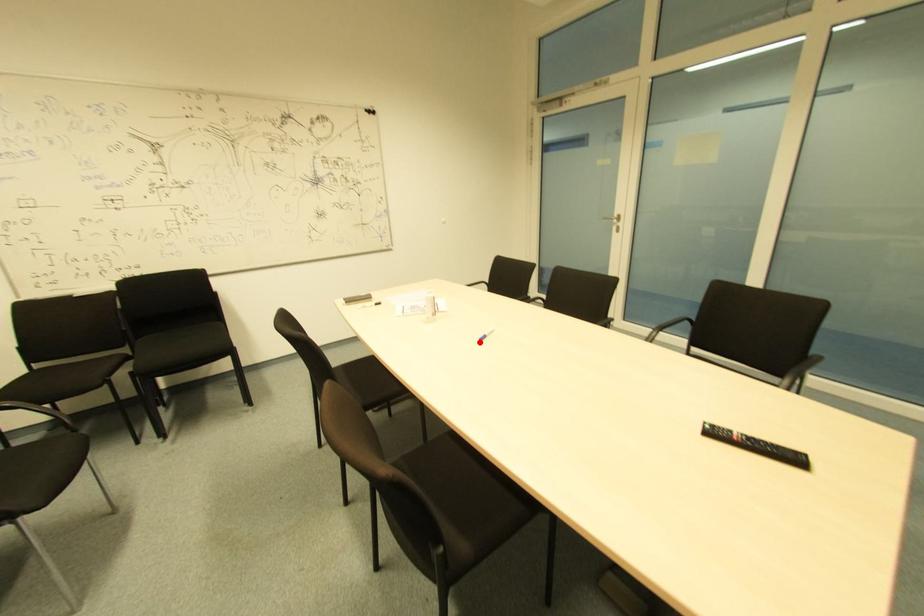
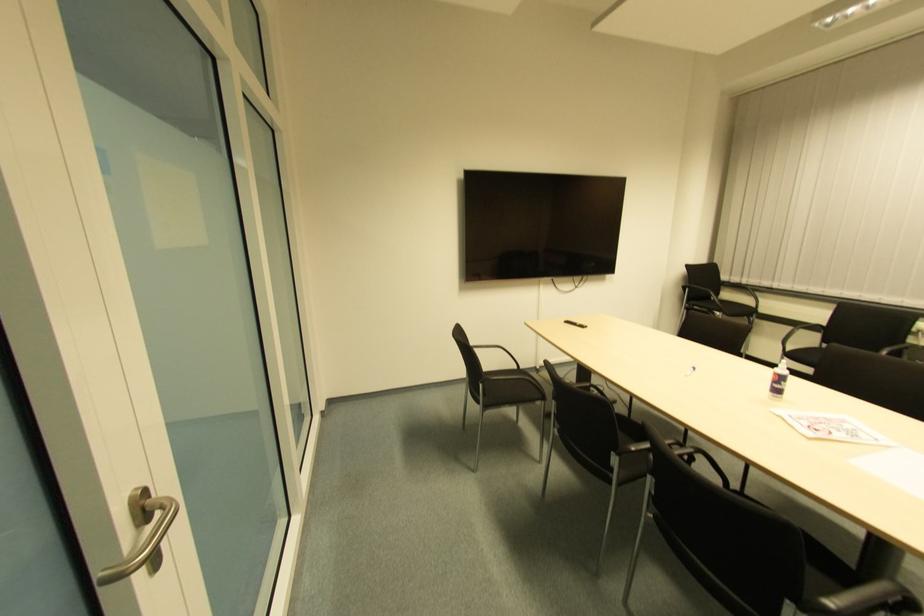
In the second image, find the point that corresponds to the highlighted location in the first image.

(691, 371)